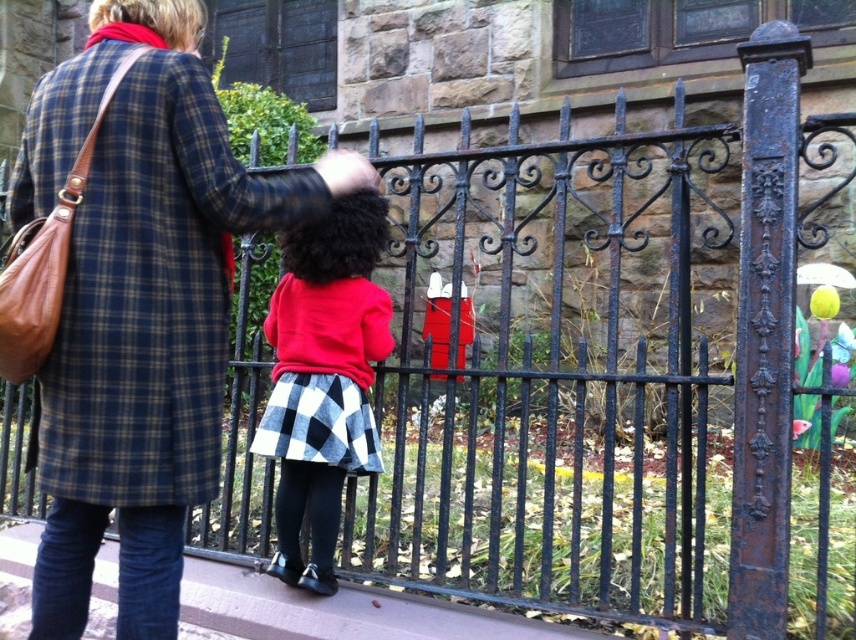
Is plaid wool coat at upper left bigger than red wool sweater at center?

Indeed, plaid wool coat at upper left has a larger size compared to red wool sweater at center.

Identify the location of plaid wool coat at upper left. The width and height of the screenshot is (856, 640). (141, 305).

Locate an element on the screen. The width and height of the screenshot is (856, 640). plaid wool coat at upper left is located at coordinates (141, 305).